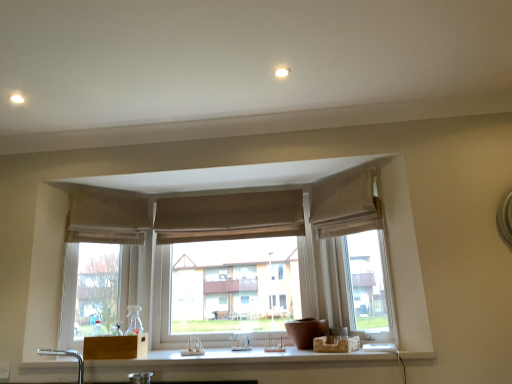
Question: In terms of height, does beige fabric curtain at upper center, the 3th curtain in the right-to-left sequence, look taller or shorter compared to brown fabric curtain at center, placed as the 2th curtain when sorted from left to right?

Choices:
 (A) tall
 (B) short

Answer: (A)

Question: In terms of width, does beige fabric curtain at upper center, the 3th curtain in the right-to-left sequence, look wider or thinner when compared to brown fabric curtain at center, placed as the 2th curtain when sorted from left to right?

Choices:
 (A) wide
 (B) thin

Answer: (A)

Question: Estimate the real-world distances between objects in this image. Which object is closer to the beige fabric curtain at upper center, the first curtain in the left-to-right sequence?

Choices:
 (A) beige fabric curtain at upper right, the 3th curtain when ordered from left to right
 (B) brown fabric curtain at center, placed as the 2th curtain when sorted from left to right

Answer: (B)

Question: Which of these objects is positioned farthest from the beige fabric curtain at upper right, the 3th curtain when ordered from left to right?

Choices:
 (A) beige fabric curtain at upper center, the first curtain in the left-to-right sequence
 (B) brown fabric curtain at center, placed as the 2th curtain when sorted from left to right

Answer: (A)